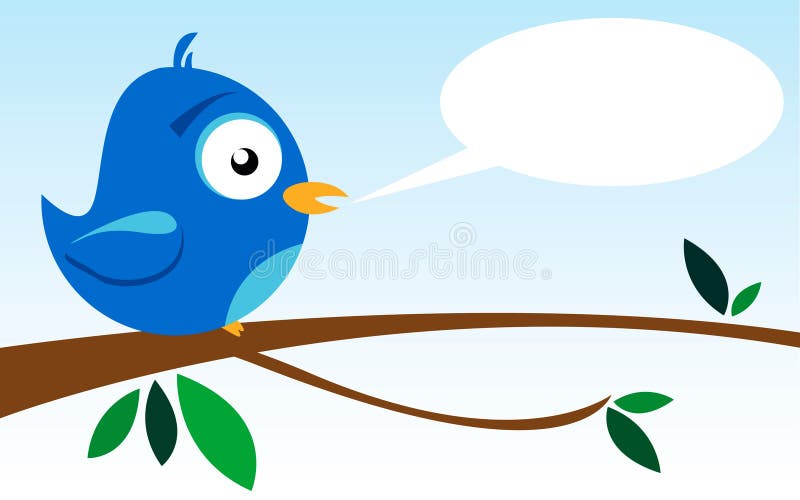
Locate an element on the screen. beam is located at coordinates (292, 204).